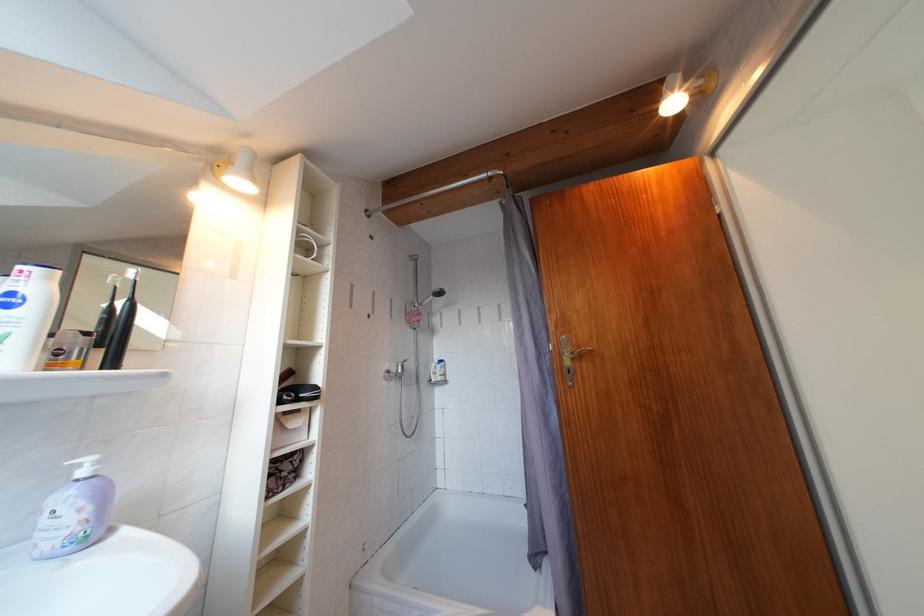
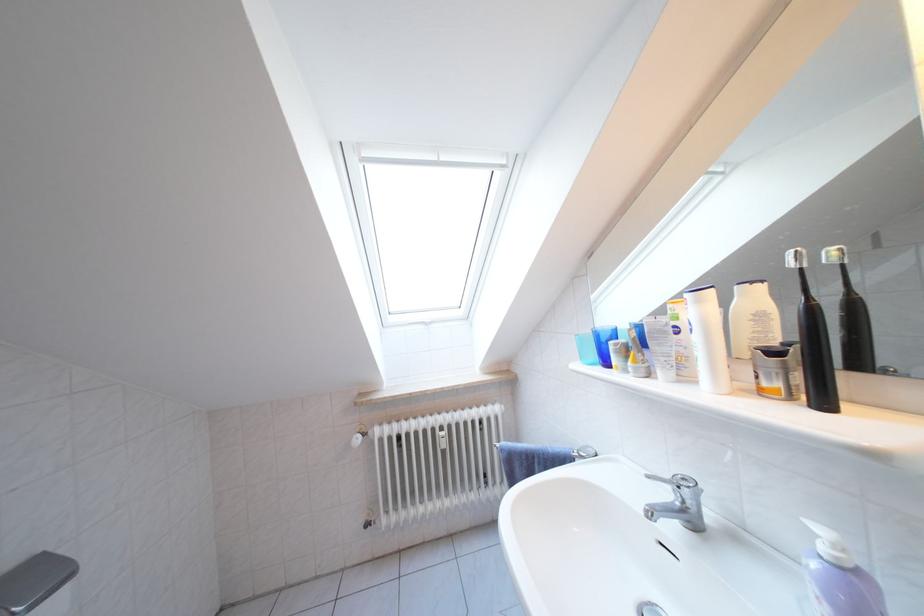
The point at (56, 283) is marked in the first image. Where is the corresponding point in the second image?

(708, 306)